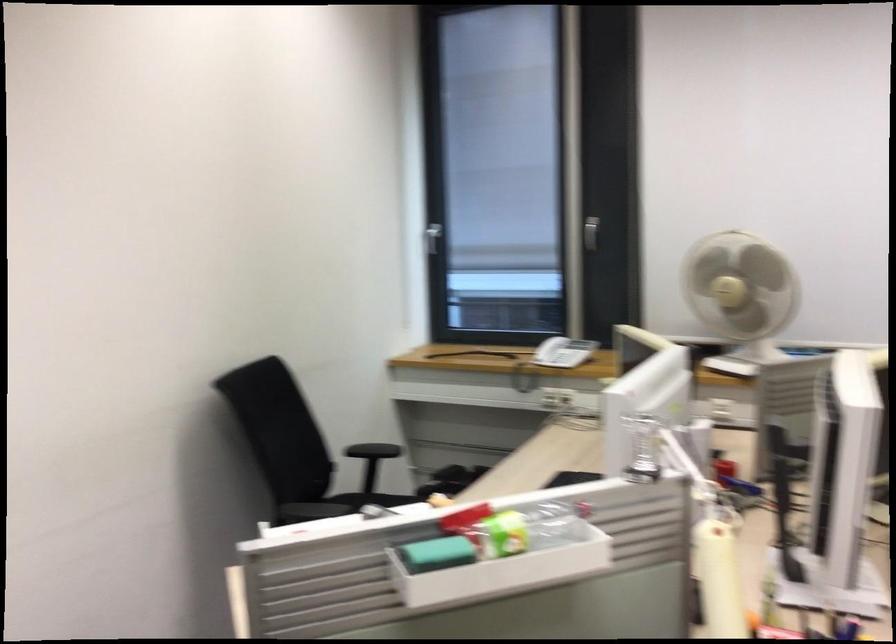
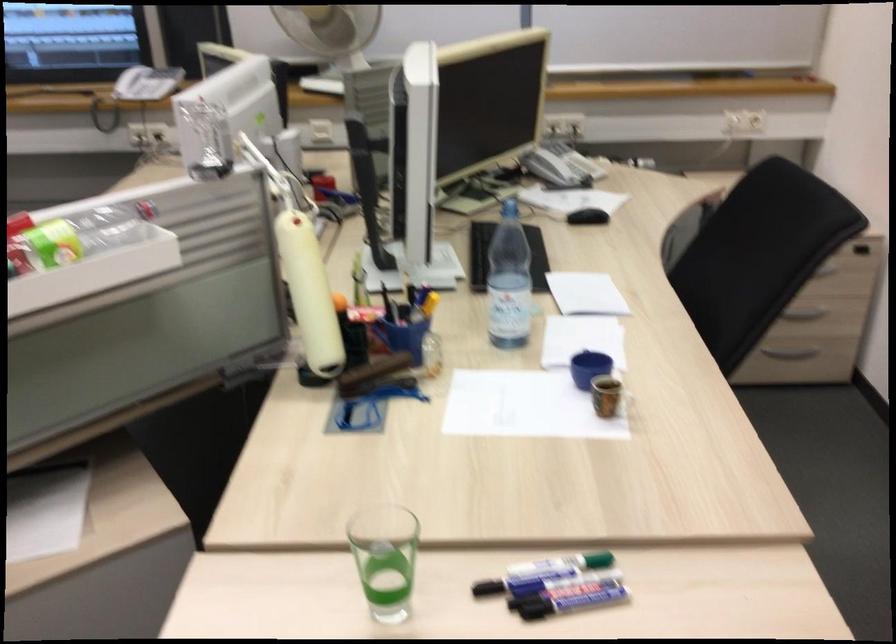
How did the camera likely rotate?

The camera rotated toward right-down.